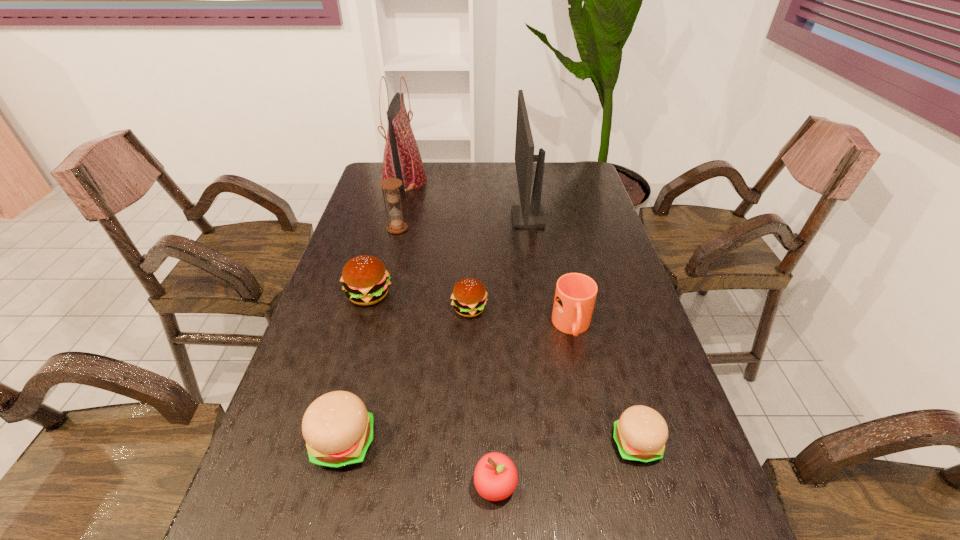
At what (x,y) coordinates should I click in order to perform the action: click on vacant space at the left edge. Please return your answer as a coordinate pair (x, y). Image resolution: width=960 pixels, height=540 pixels. Looking at the image, I should click on (332, 315).

Locate an element on the screen. vacant space at the right edge of the desktop is located at coordinates 564,197.

You are a GUI agent. You are given a task and a screenshot of the screen. Output one action in this format:
    pyautogui.click(x=<x>, y=<y>)
    Task: Click on the free space at the far left corner of the desktop
    
    Given the screenshot: What is the action you would take?
    pyautogui.click(x=366, y=184)

At what (x,y) coordinates should I click in order to perform the action: click on free space that is in between the computer monitor and the second hamburger from right to left. Please return your answer as a coordinate pair (x, y). The width and height of the screenshot is (960, 540). Looking at the image, I should click on (499, 263).

Where is `vacant point located between the red apple and the orange mug`? This screenshot has width=960, height=540. vacant point located between the red apple and the orange mug is located at coordinates (534, 407).

The height and width of the screenshot is (540, 960). Identify the location of unoccupied position between the third hamburger from left to right and the right beige hamburger. (553, 376).

Find the location of a particular element. Image resolution: width=960 pixels, height=540 pixels. free area in between the smaller beige hamburger and the handbag is located at coordinates (520, 312).

This screenshot has height=540, width=960. I want to click on free space between the computer monitor and the bigger beige hamburger, so point(436,330).

Where is `blank region between the mug and the left beige hamburger`? Image resolution: width=960 pixels, height=540 pixels. blank region between the mug and the left beige hamburger is located at coordinates (458, 385).

The width and height of the screenshot is (960, 540). Identify the location of free space between the third tallest object and the bigger brown hamburger. (383, 262).